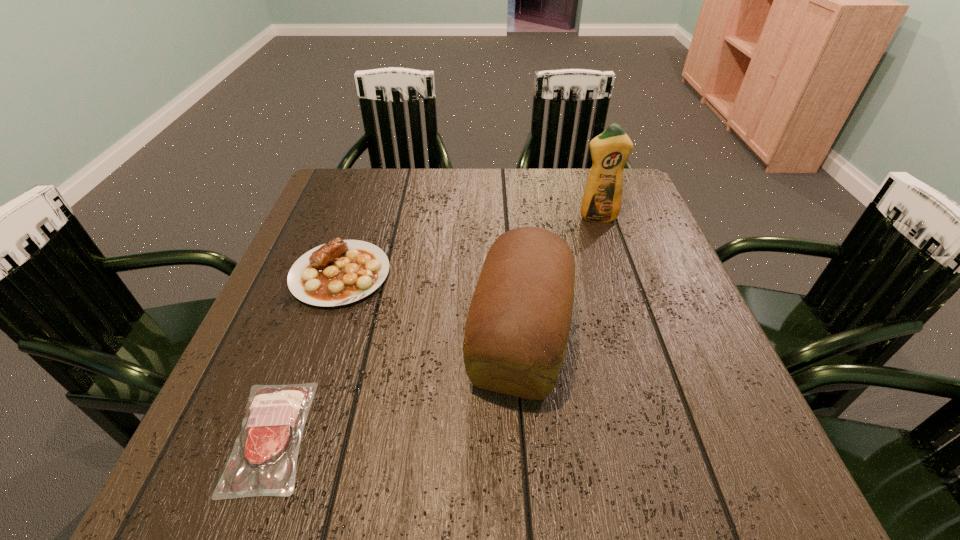
Image resolution: width=960 pixels, height=540 pixels. Identify the location of free space between the farther steak and the shorter steak. (305, 355).

Find the location of `free space between the bread and the shorter steak`. free space between the bread and the shorter steak is located at coordinates (395, 387).

This screenshot has height=540, width=960. In order to click on free space that is in between the bread and the taller steak in this screenshot , I will do `click(430, 306)`.

Find the location of a particular element. This screenshot has height=540, width=960. free spot between the farther steak and the shorter steak is located at coordinates (305, 355).

This screenshot has height=540, width=960. In order to click on vacant region between the third tallest object and the nearer steak in this screenshot , I will do `click(305, 355)`.

Locate an element on the screen. Image resolution: width=960 pixels, height=540 pixels. empty location between the rightmost object and the third tallest object is located at coordinates (468, 246).

Locate an element on the screen. Image resolution: width=960 pixels, height=540 pixels. empty space that is in between the shorter steak and the farther steak is located at coordinates (305, 355).

This screenshot has width=960, height=540. I want to click on free area in between the farther steak and the detergent, so click(x=468, y=246).

At what (x,y) coordinates should I click in order to perform the action: click on object that is the nearest to the shortest object. Please return your answer as a coordinate pair (x, y). Looking at the image, I should click on (340, 272).

Point out which object is positioned as the third nearest to the shorter steak. Please provide its 2D coordinates. Your answer should be formatted as a tuple, i.e. [(x, y)], where the tuple contains the x and y coordinates of a point satisfying the conditions above.

[(602, 199)]